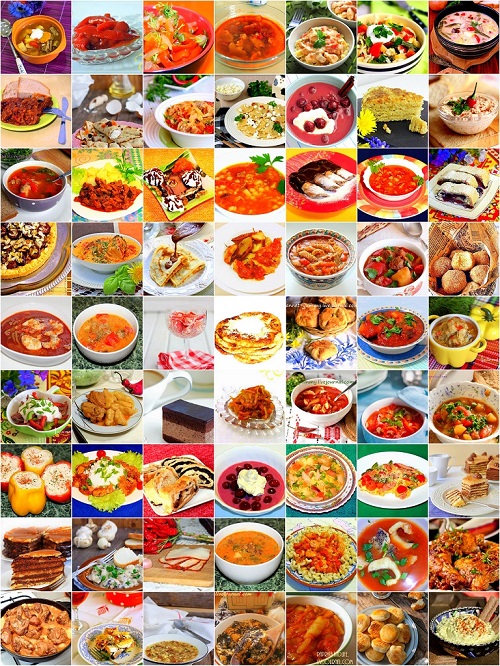
Identify the location of pictures in the bottom row. (20, 631), (96, 631), (162, 627), (246, 633), (312, 631), (372, 633), (482, 641).